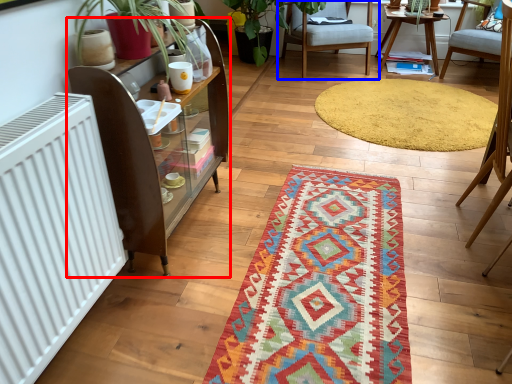
Question: Which of the following is the farthest to the observer, shelf (highlighted by a red box) or chair (highlighted by a blue box)?

Choices:
 (A) shelf
 (B) chair

Answer: (B)